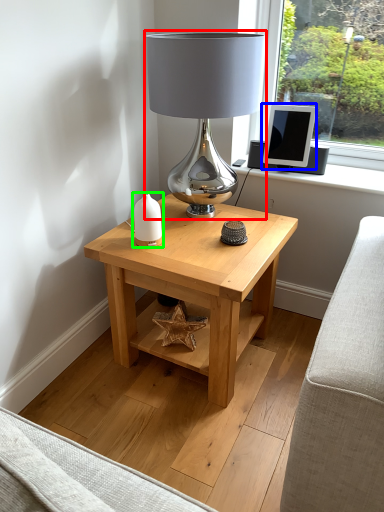
Question: Which object is the farthest from lamp (highlighted by a red box)? Choose among these: computer monitor (highlighted by a blue box) or candle holder (highlighted by a green box).

Choices:
 (A) computer monitor
 (B) candle holder

Answer: (A)